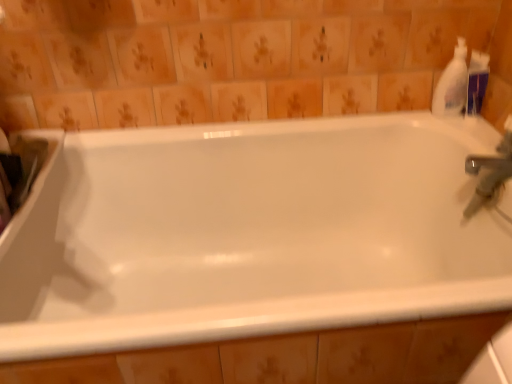
Image resolution: width=512 pixels, height=384 pixels. Find the location of `white plastic bottle at upper right`. white plastic bottle at upper right is located at coordinates (452, 84).

Describe the element at coordinates (452, 84) in the screenshot. This screenshot has height=384, width=512. I see `white plastic bottle at upper right` at that location.

Measure the distance between point (x=315, y=273) and camera.

A distance of 4.06 feet exists between point (x=315, y=273) and camera.

In the scene shown: In order to face white glossy bathtub at center, should I rotate leftwards or rightwards?

A 4.173 degree turn to the left will do.

The height and width of the screenshot is (384, 512). I want to click on white glossy bathtub at center, so click(x=249, y=234).

What do you see at coordinates (249, 234) in the screenshot? The width and height of the screenshot is (512, 384). I see `white glossy bathtub at center` at bounding box center [249, 234].

Locate an element on the screen. This screenshot has height=384, width=512. white plastic bottle at upper right is located at coordinates (452, 84).

Considering the positions of objects white glossy bathtub at center and white plastic bottle at upper right in the image provided, who is more to the right, white glossy bathtub at center or white plastic bottle at upper right?

Positioned to the right is white plastic bottle at upper right.

Between white glossy bathtub at center and white plastic bottle at upper right, which one is positioned behind?

white plastic bottle at upper right is further away from the camera.

Considering the positions of points (228, 126) and (439, 90), is point (228, 126) farther from camera compared to point (439, 90)?

That is True.

From the image's perspective, which is above, white glossy bathtub at center or white plastic bottle at upper right?

white plastic bottle at upper right, from the image's perspective.

From a real-world perspective, is white glossy bathtub at center beneath white plastic bottle at upper right?

Indeed, from a real-world perspective, white glossy bathtub at center is positioned beneath white plastic bottle at upper right.

Can you confirm if white glossy bathtub at center is thinner than white plastic bottle at upper right?

No, white glossy bathtub at center is not thinner than white plastic bottle at upper right.

Does white glossy bathtub at center have a greater height compared to white plastic bottle at upper right?

Yes.

Between white glossy bathtub at center and white plastic bottle at upper right, which one has smaller size?

With smaller size is white plastic bottle at upper right.

Based on the photo, is white glossy bathtub at center spatially inside white plastic bottle at upper right, or outside of it?

white glossy bathtub at center is outside white plastic bottle at upper right.

Is the surface of white glossy bathtub at center in direct contact with white plastic bottle at upper right?

No, white glossy bathtub at center is not in contact with white plastic bottle at upper right.

Is white glossy bathtub at center aimed at white plastic bottle at upper right?

No.

Can you tell me how much white glossy bathtub at center and white plastic bottle at upper right differ in facing direction?

The angle between the facing direction of white glossy bathtub at center and the facing direction of white plastic bottle at upper right is 0.982 degrees.

How distant is white glossy bathtub at center from white plastic bottle at upper right?

They are 21.13 inches apart.

At what (x,y) coordinates should I click in order to perform the action: click on bathtub below the white plastic bottle at upper right (from the image's perspective). Please return your answer as a coordinate pair (x, y). Image resolution: width=512 pixels, height=384 pixels. Looking at the image, I should click on coord(249,234).

Is white plastic bottle at upper right to the left of white glossy bathtub at center from the viewer's perspective?

Incorrect, white plastic bottle at upper right is not on the left side of white glossy bathtub at center.

Which object is closer to the camera, white plastic bottle at upper right or white glossy bathtub at center?

Positioned in front is white glossy bathtub at center.

Is point (460, 113) positioned behind point (211, 146)?

No, (460, 113) is closer to viewer.

From the image's perspective, which is below, white plastic bottle at upper right or white glossy bathtub at center?

white glossy bathtub at center appears lower in the image.

From a real-world perspective, is white plastic bottle at upper right physically below white glossy bathtub at center?

Actually, white plastic bottle at upper right is physically above white glossy bathtub at center in the real world.

Which of these two, white plastic bottle at upper right or white glossy bathtub at center, is thinner?

Thinner between the two is white plastic bottle at upper right.

Considering the sizes of white plastic bottle at upper right and white glossy bathtub at center in the image, is white plastic bottle at upper right taller or shorter than white glossy bathtub at center?

white plastic bottle at upper right is shorter than white glossy bathtub at center.

Looking at the image, does white plastic bottle at upper right seem bigger or smaller compared to white glossy bathtub at center?

white plastic bottle at upper right is smaller than white glossy bathtub at center.

Is white glossy bathtub at center a part of white plastic bottle at upper right?

No, white glossy bathtub at center is not surrounded by white plastic bottle at upper right.

Looking at this image, is white plastic bottle at upper right placed right next to white glossy bathtub at center?

white plastic bottle at upper right and white glossy bathtub at center are not in contact.

Does white plastic bottle at upper right turn towards white glossy bathtub at center?

No, white plastic bottle at upper right is not aimed at white glossy bathtub at center.

This screenshot has width=512, height=384. What are the coordinates of `cleaning product behind the white glossy bathtub at center` in the screenshot? It's located at (452, 84).

In order to click on cleaning product that is on the right side of white glossy bathtub at center in this screenshot , I will do `click(452, 84)`.

Where is `bathtub on the left of white plastic bottle at upper right`? The width and height of the screenshot is (512, 384). bathtub on the left of white plastic bottle at upper right is located at coordinates (249, 234).